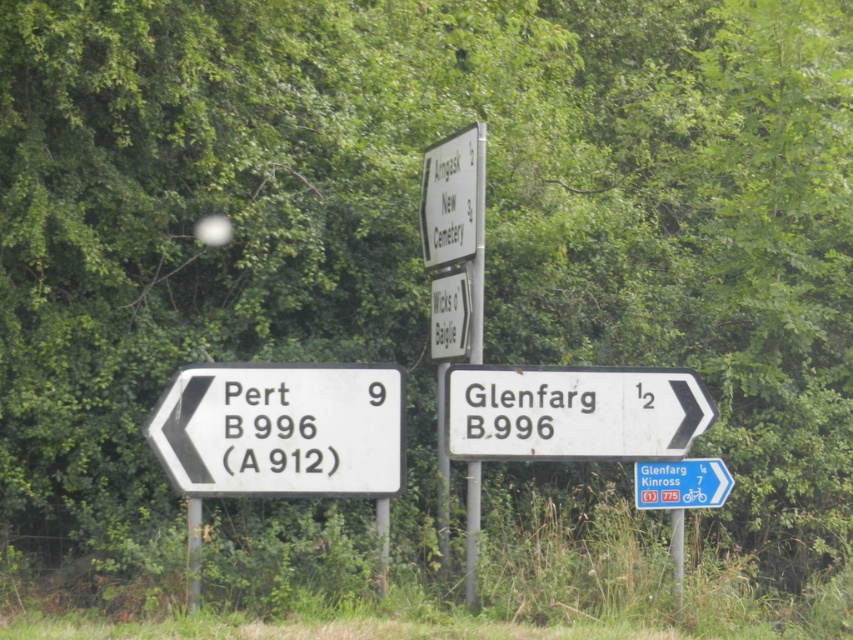
You are standing in front of the signpost and need to read both the white plastic sign at left and the white plastic sign at center right. Which sign will you need to tilt your head more to read properly?

The white plastic sign at left has a smaller size compared to white plastic sign at center right, so you will need to tilt your head more to read the white plastic sign at left properly.

Consider the image. You are standing in front of the roadside directional signpost in a green area. You see the white plastic sign at left and the white plastic sign at center right. Which one is located below the other?

The white plastic sign at left is positioned under the white plastic sign at center right, so the one at left is below the one at center right.